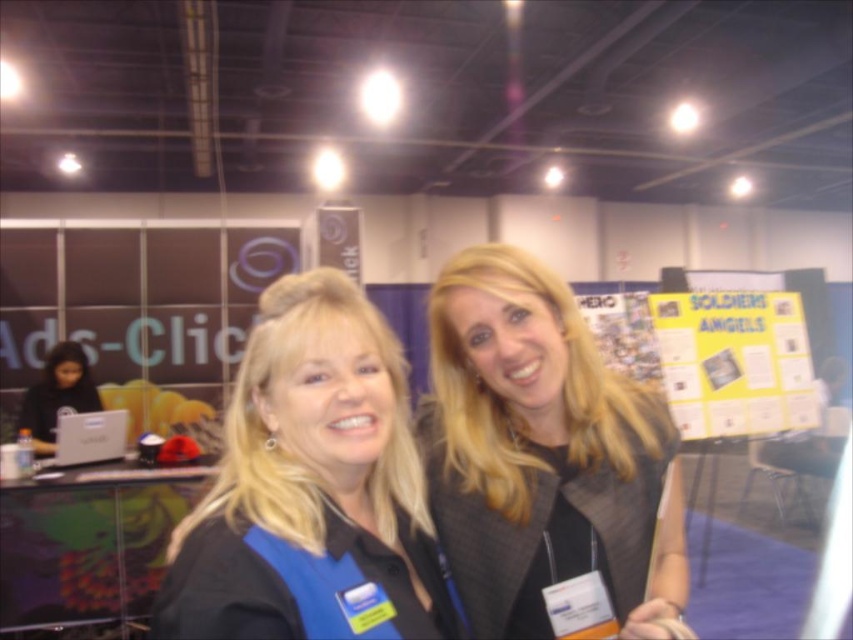
Consider the image. You are setting up a photo shoot at a convention booth. You have a blue fabric shirt at center and a black matte laptop at left. To ensure the laptop remains visible in the background, should you adjust the lighting to be brighter or dimmer?

The blue fabric shirt at center is in front of the black matte laptop at left, so adjusting the lighting to be brighter would help the laptop remain visible in the background by reducing shadows caused by the shirt blocking light.

You are setting up a photo shoot for a tech event and need to ensure that the gray textured blazer at center and the black matte laptop at left are visible in the frame. Based on their positions, which object is covering part of the other?

The gray textured blazer at center is positioned over the black matte laptop at left, so the blazer is covering part of the laptop.

You are a photographer adjusting the lighting for a group photo. You notice the gray textured blazer at center and the blue fabric shirt at center. Which clothing item requires more space to avoid overcrowding in the frame?

The gray textured blazer at center requires more space because its width surpasses that of the blue fabric shirt at center, so it needs adequate room to avoid overcrowding in the frame.